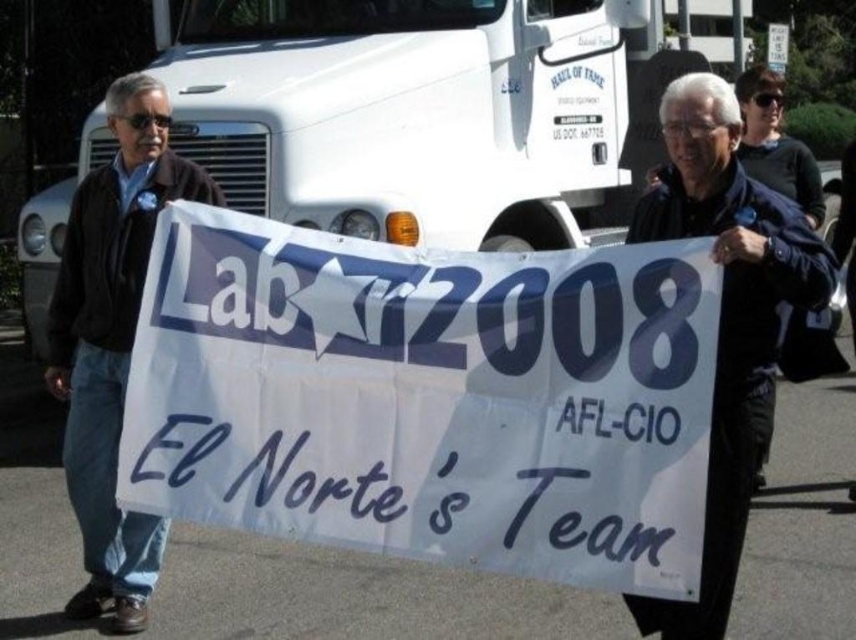
From the picture: You are a photographer trying to capture a photo of the white paper banner at center and the black leather jacket at center. The minimum focus distance for your camera is 30 inches. Can you focus on both objects without adjusting your camera settings?

The white paper banner at center and black leather jacket at center are 31.80 inches apart from each other. Since the minimum focus distance is 30 inches, the camera can focus on both objects without needing adjustments.

Looking at this image, you are a photographer trying to capture a photo of the two men holding the banner. You need to ensure the white paper banner at center is fully visible in the frame. Given that the dark brown leather jacket at left is partially blocking the banner, can you determine if the banner can still be fully captured without cropping?

The white paper banner at center is wider than the dark brown leather jacket at left, so even if the jacket is partially blocking it, the banner can still be fully captured without cropping as its width surpasses the jacket.